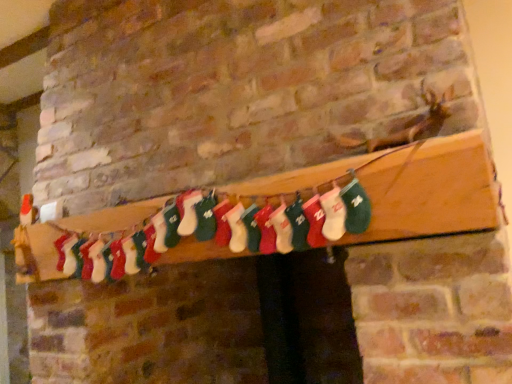
Locate an element on the screen. Image resolution: width=512 pixels, height=384 pixels. wooden plank at center is located at coordinates pos(431,190).

Describe the element at coordinates (431, 190) in the screenshot. I see `wooden plank at center` at that location.

Identify the location of wooden plank at center. (431, 190).